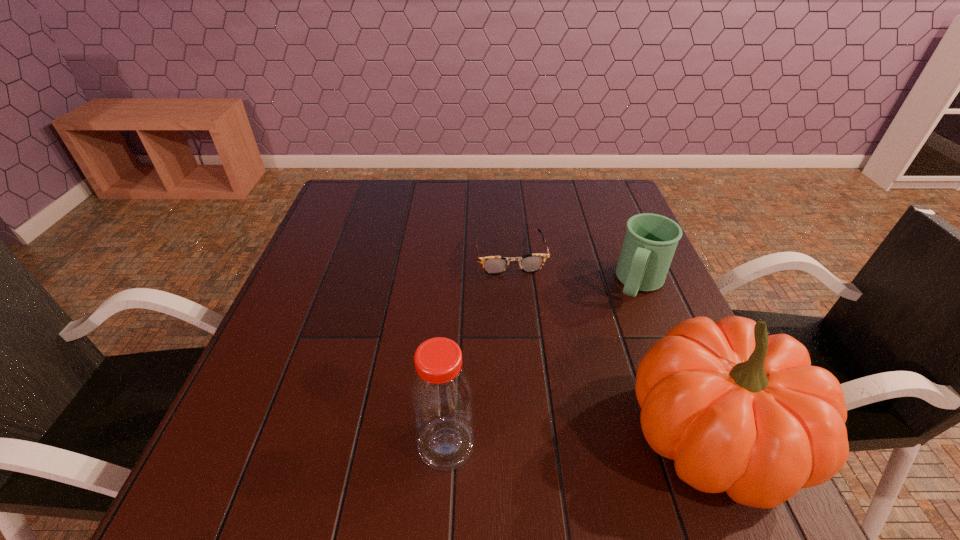
The image size is (960, 540). I want to click on free space that is in between the spectacles and the bottle, so click(478, 350).

Locate an element on the screen. free area in between the pumpkin and the shortest object is located at coordinates click(x=612, y=347).

Locate an element on the screen. The height and width of the screenshot is (540, 960). free spot between the bottle and the mug is located at coordinates (543, 364).

Locate which object is the closest to the shortest object. Please provide its 2D coordinates. Your answer should be formatted as a tuple, i.e. [(x, y)], where the tuple contains the x and y coordinates of a point satisfying the conditions above.

[(650, 241)]

Locate which object ranks third in proximity to the spectacles. Please provide its 2D coordinates. Your answer should be formatted as a tuple, i.e. [(x, y)], where the tuple contains the x and y coordinates of a point satisfying the conditions above.

[(441, 394)]

Find the location of a particular element. This screenshot has width=960, height=540. vacant region that satisfies the following two spatial constraints: 1. on the back side of the mug; 2. on the left side of the bottle is located at coordinates coord(456,284).

This screenshot has height=540, width=960. I want to click on vacant area that satisfies the following two spatial constraints: 1. on the front side of the pumpkin; 2. on the left side of the shortest object, so click(x=525, y=438).

Identify the location of free spot that satisfies the following two spatial constraints: 1. on the front side of the pumpkin; 2. on the right side of the third tallest object. (703, 438).